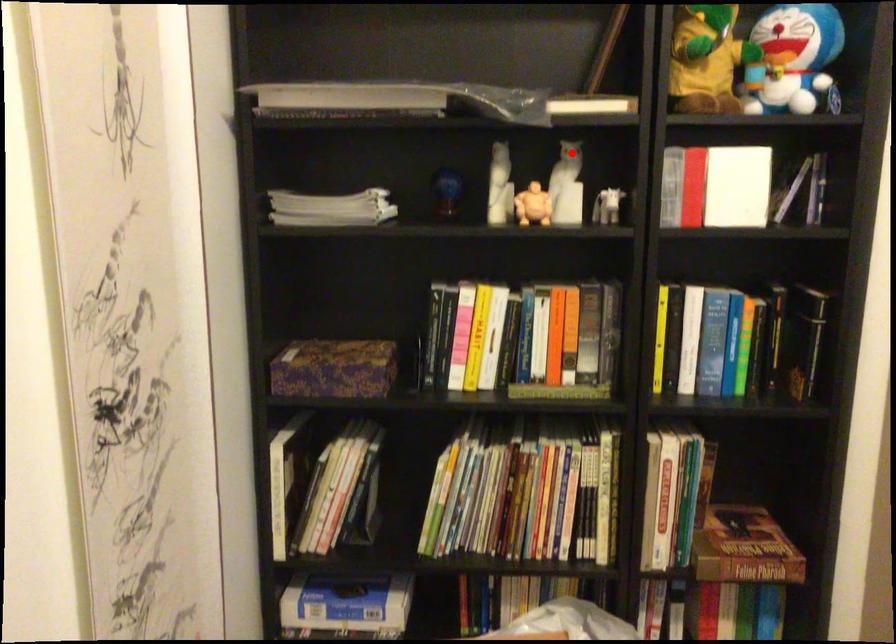
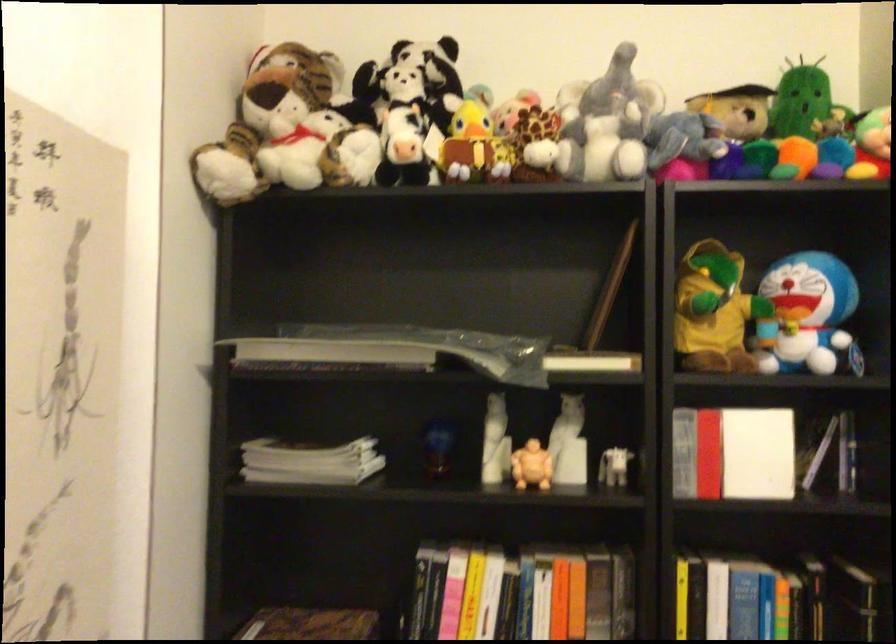
Where in the second image is the point corresponding to the highlighted location from the first image?

(572, 409)